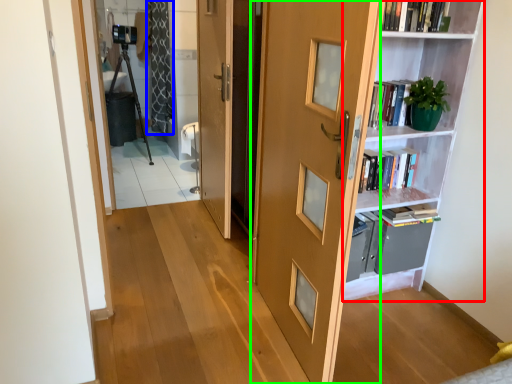
Question: Which object is the farthest from shelf (highlighted by a red box)? Choose among these: curtain (highlighted by a blue box) or door (highlighted by a green box).

Choices:
 (A) curtain
 (B) door

Answer: (A)